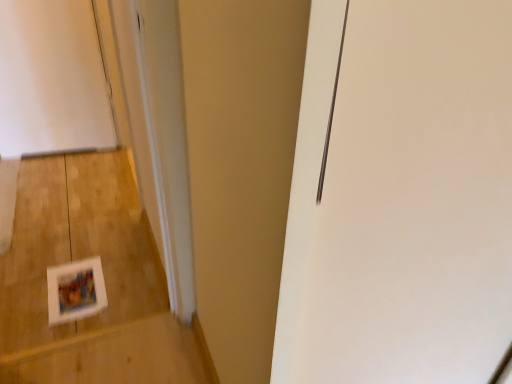
At what (x,y) coordinates should I click in order to perform the action: click on space that is in front of matte white postcard at lower left. Please return your answer as a coordinate pair (x, y). The image size is (512, 384). Looking at the image, I should click on (46, 322).